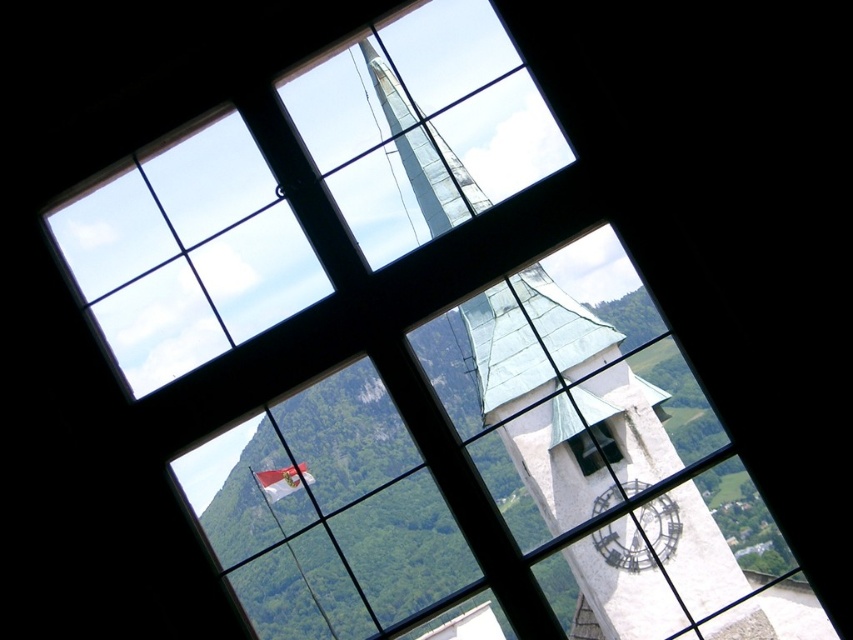
You are standing in front of a large window with a view of a white stone clock tower at center and a metallic clock face at lower right. If you want to touch both objects, which one would you need to walk closer to first?

The white stone clock tower at center is 10.73 meters away from the metallic clock face at lower right. Since the white stone clock tower at center is farther away, you would need to walk closer to it first.

You are an architect examining the window design. You notice the white stone clock tower at center and the transparent glass clock at center. Which one appears closer to you through the window?

The white stone clock tower at center appears closer because it is in front of the transparent glass clock at center.

You are an architect reviewing blueprints and notice two clock features in the design. The white stone clock tower at center and the transparent glass clock at center. Which one is positioned higher in the structure?

The white stone clock tower at center is above the transparent glass clock at center, so it is positioned higher in the structure.